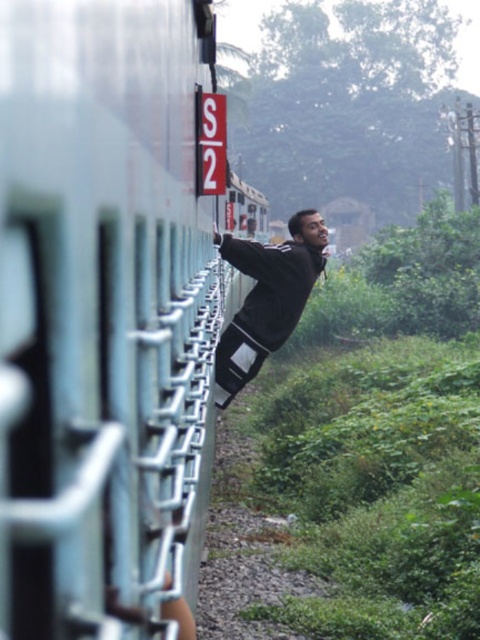
Based on the scene description, where is the metallic silver train at center located in the image?

The metallic silver train at center is located at point (105,314) in the image.

You are standing at the point marked by coordinates point (105,314). What object are you touching?

The point (105,314) corresponds to the metallic silver train at center, so you are touching the metallic silver train at center.